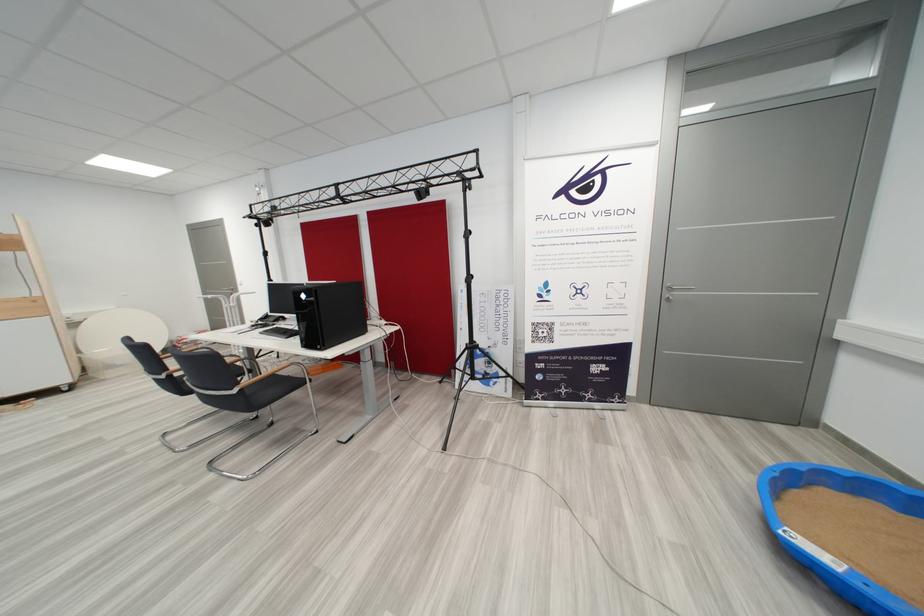
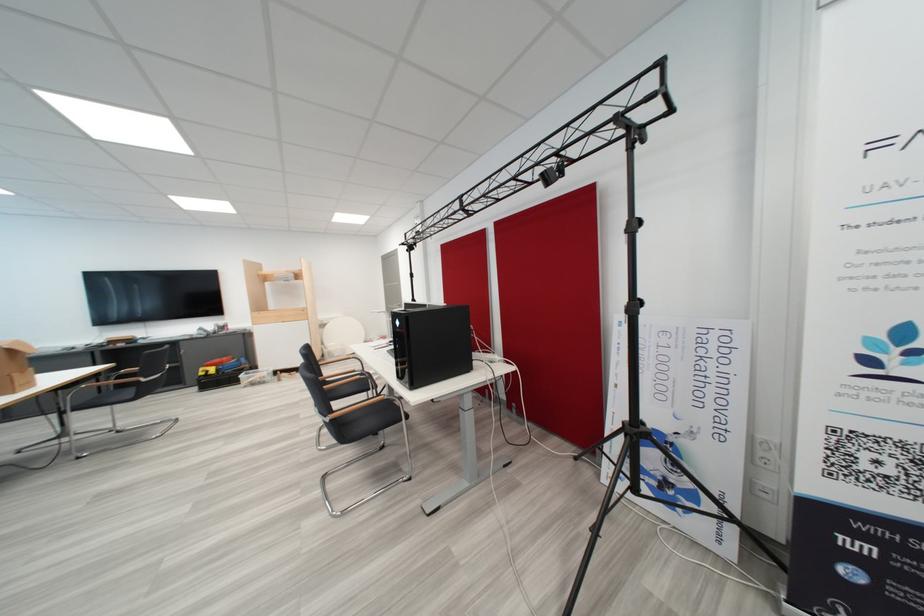
In the second image, find the point that corresponds to (x=313, y=299) in the first image.

(407, 325)